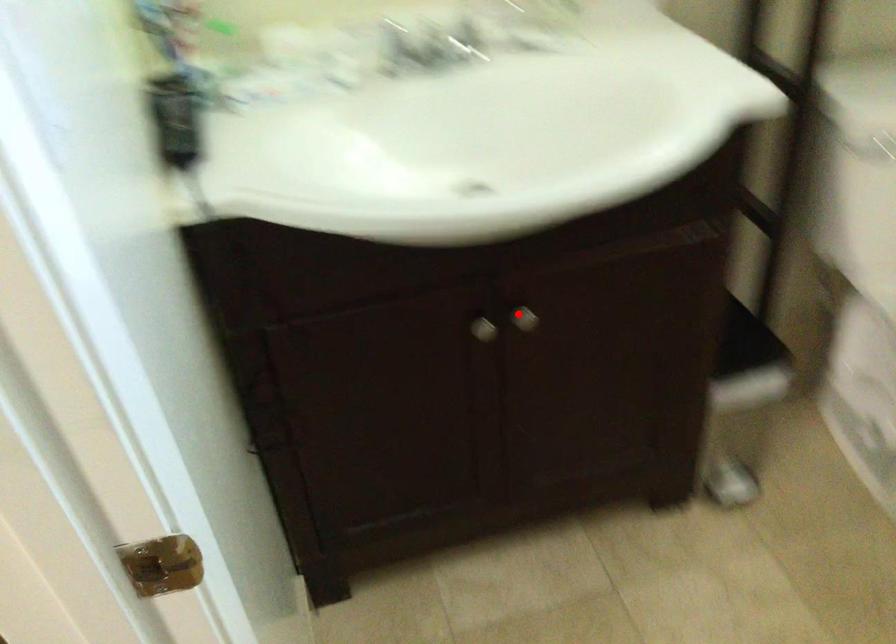
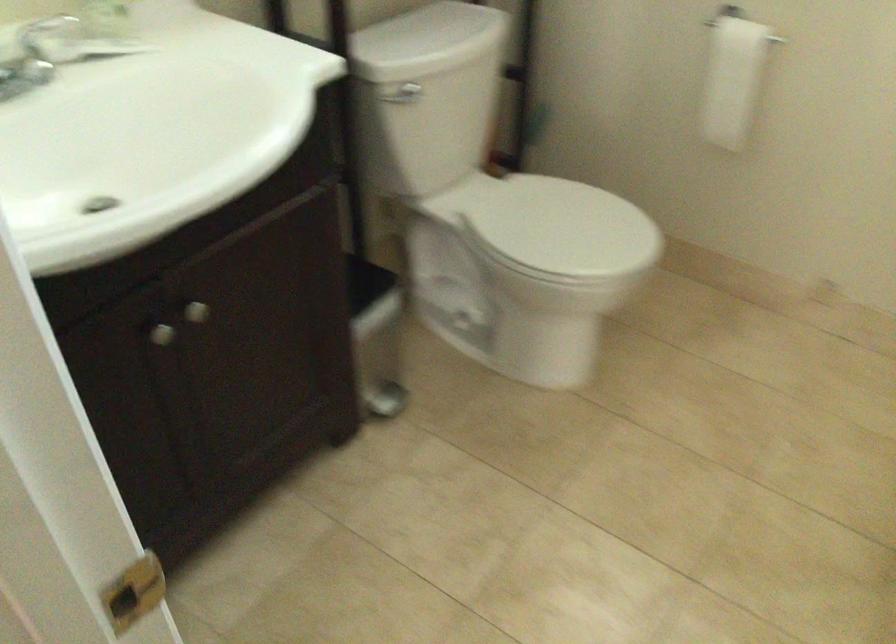
Find the pixel in the second image that matches the highlighted location in the first image.

(195, 312)